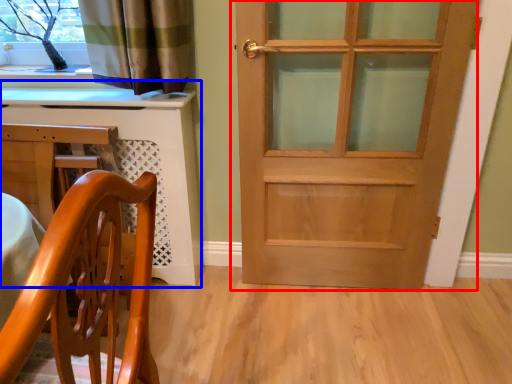
Question: Which of the following is the farthest to the observer, door (highlighted by a red box) or computer desk (highlighted by a blue box)?

Choices:
 (A) door
 (B) computer desk

Answer: (B)